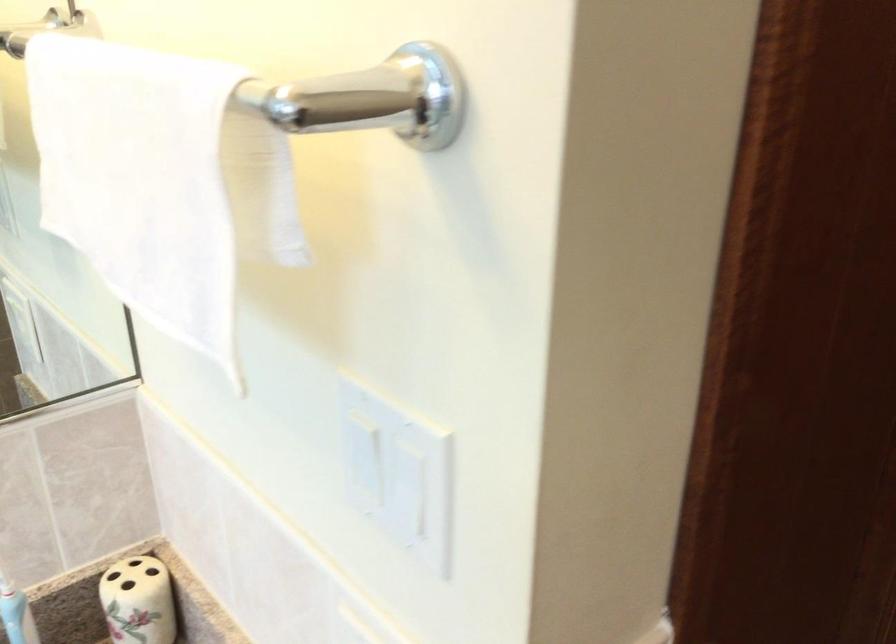
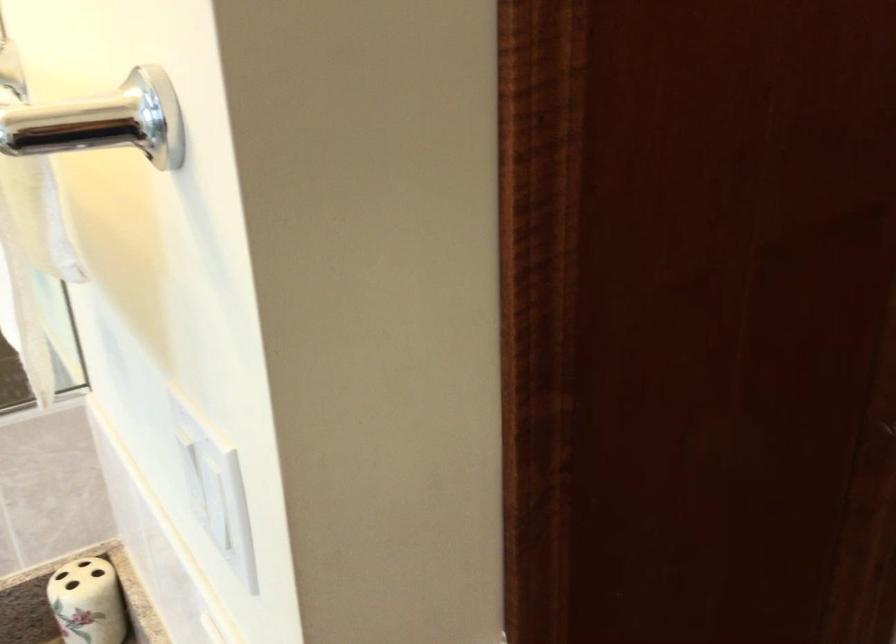
Question: The images are taken continuously from a first-person perspective. In which direction are you moving?

Choices:
 (A) Left
 (B) Right
 (C) Forward
 (D) Backward

Answer: (B)